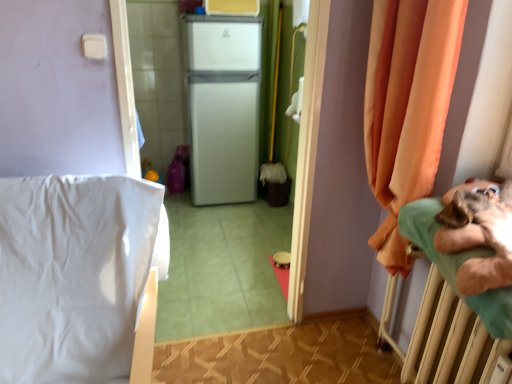
Image resolution: width=512 pixels, height=384 pixels. I want to click on free region under orange fabric curtain at right (from a real-world perspective), so click(352, 337).